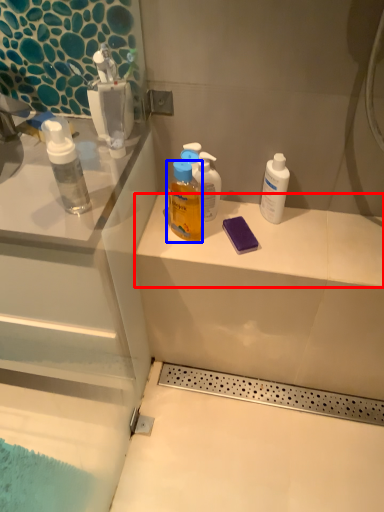
Question: Which object is further to the camera taking this photo, counter top (highlighted by a red box) or bottle (highlighted by a blue box)?

Choices:
 (A) counter top
 (B) bottle

Answer: (A)